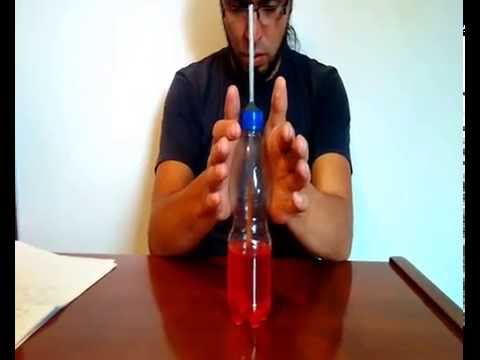
Image resolution: width=480 pixels, height=360 pixels. Find the location of `clear bottle to contain liquids`. clear bottle to contain liquids is located at coordinates (248, 268).